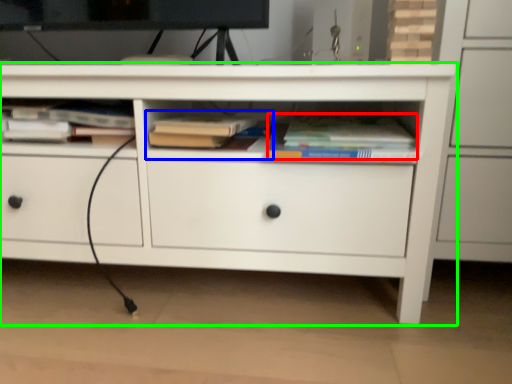
Question: Which is farther away from book (highlighted by a red box)? book (highlighted by a blue box) or chest of drawers (highlighted by a green box)?

Choices:
 (A) book
 (B) chest of drawers

Answer: (B)